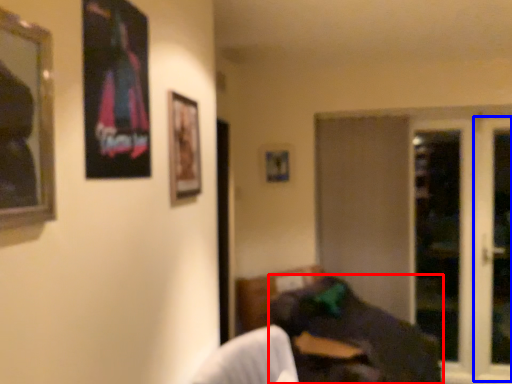
Question: Which point is closer to the camera, bean bag chair (highlighted by a red box) or screen door (highlighted by a blue box)?

Choices:
 (A) bean bag chair
 (B) screen door

Answer: (A)